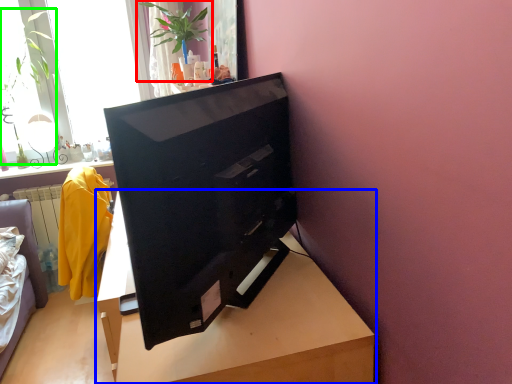
Question: Which object is the farthest from houseplant (highlighted by a red box)? Choose among these: table (highlighted by a blue box) or plant (highlighted by a green box).

Choices:
 (A) table
 (B) plant

Answer: (A)